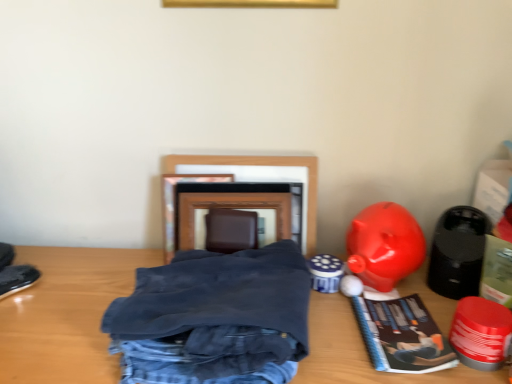
Question: From a real-world perspective, relative to wooden table at center, is shiny red plastic toy at lower right, the second toy from the right, vertically above or below?

Choices:
 (A) below
 (B) above

Answer: (B)

Question: Is shiny red plastic toy at lower right, the second toy from the right, spatially inside wooden table at center, or outside of it?

Choices:
 (A) outside
 (B) inside

Answer: (A)

Question: Based on their relative distances, which object is farther from the matte paper book at lower right?

Choices:
 (A) black suede shoe at left
 (B) wooden table at center
 (C) shiny plastic piggy bank at right, arranged as the first toy when viewed from the left
 (D) wooden picture frame at center
 (E) dark blue cotton pants at center

Answer: (A)

Question: Estimate the real-world distances between objects in this image. Which object is farther from the matte paper book at lower right?

Choices:
 (A) black matte speaker at right, acting as the third toy starting from the left
 (B) wooden picture frame at center
 (C) black suede shoe at left
 (D) shiny plastic piggy bank at right, arranged as the first toy when viewed from the left
 (E) wooden table at center

Answer: (C)